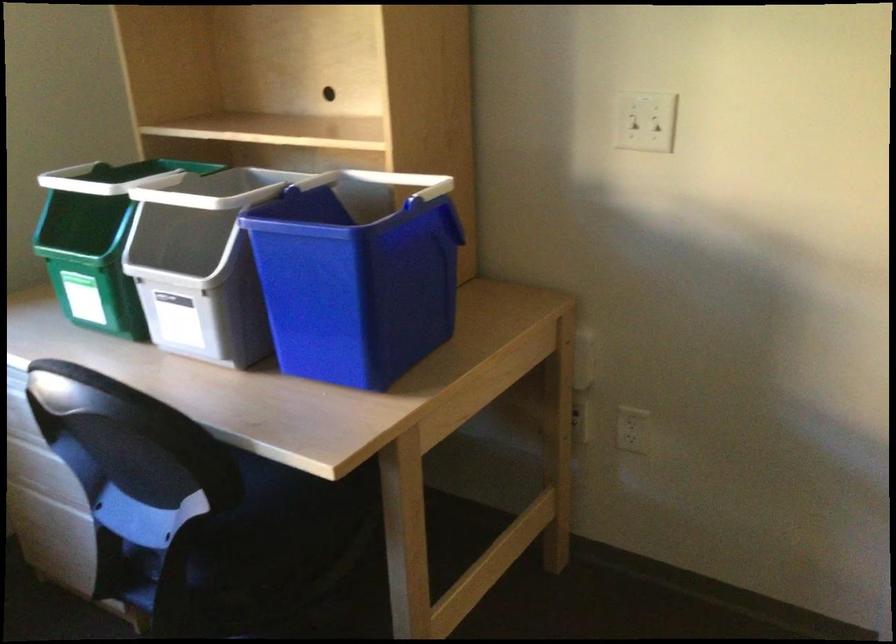
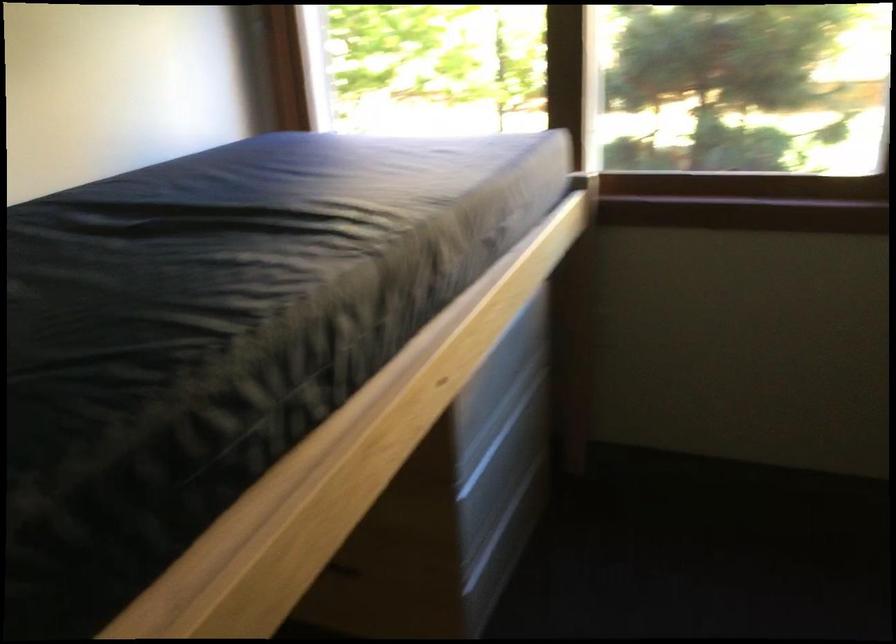
In the scene shown: The first image is from the beginning of the video and the second image is from the end. How did the camera likely rotate when shooting the video?

The camera's rotation is toward left-down.